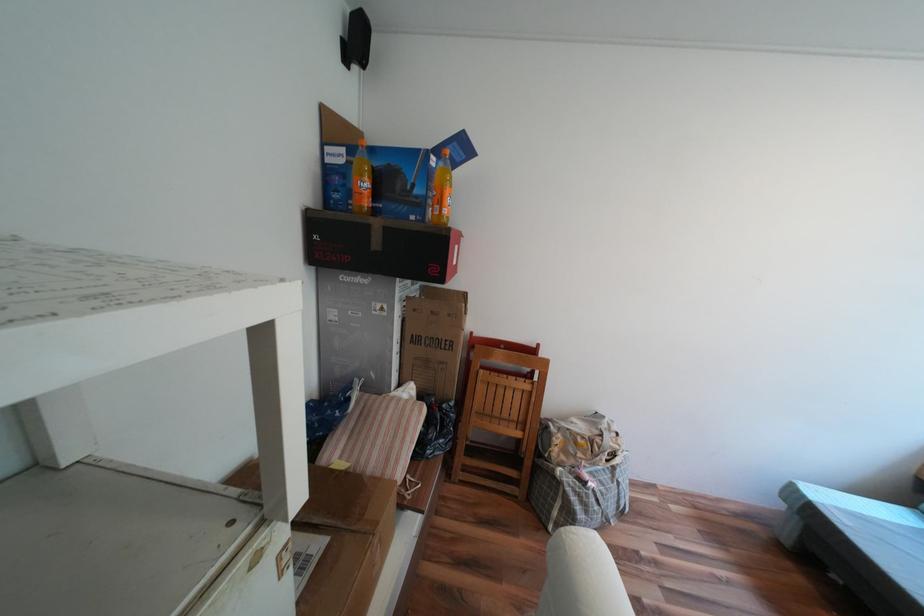
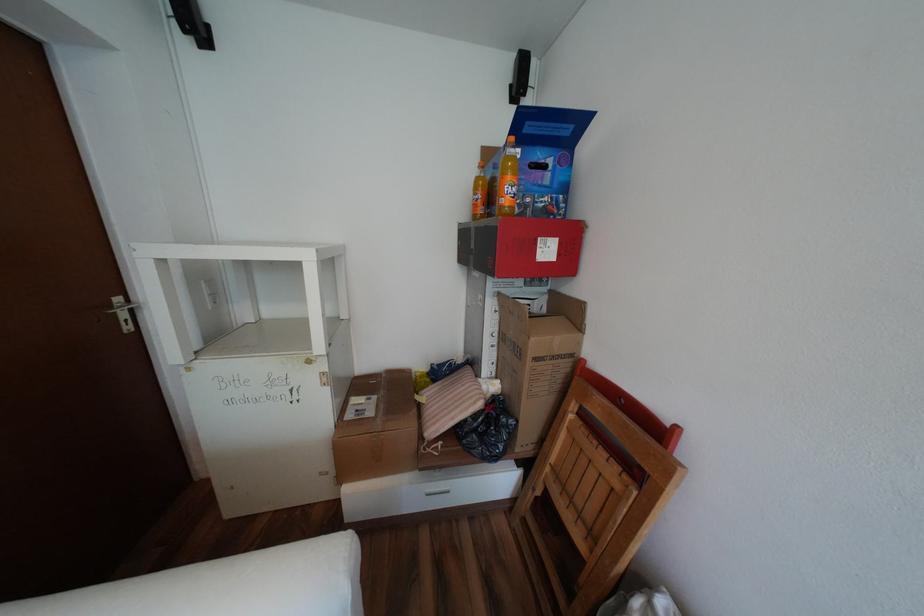
The point at (408,341) is marked in the first image. Where is the corresponding point in the second image?

(505, 334)